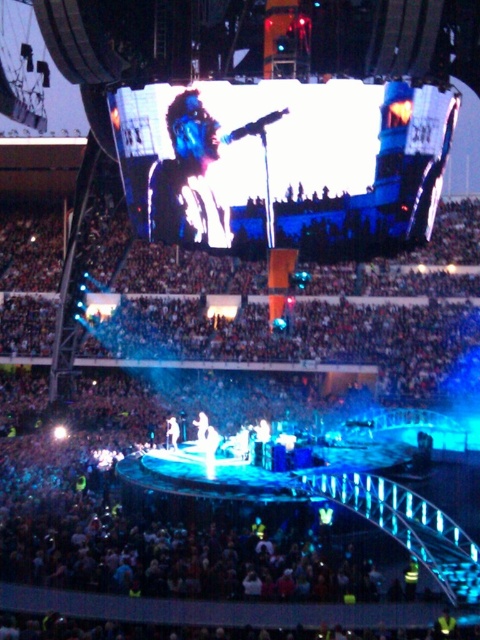
Question: Does matte black face at upper center have a smaller size compared to shiny silver microphone at center?

Choices:
 (A) no
 (B) yes

Answer: (A)

Question: Is matte black face at upper center smaller than shiny silver microphone at center?

Choices:
 (A) no
 (B) yes

Answer: (A)

Question: Is matte black face at upper center to the left of shiny silver microphone at center from the viewer's perspective?

Choices:
 (A) yes
 (B) no

Answer: (B)

Question: Among these points, which one is farthest from the camera?

Choices:
 (A) (166, 435)
 (B) (154, 179)

Answer: (A)

Question: Which point is farther to the camera?

Choices:
 (A) matte black face at upper center
 (B) shiny silver microphone at center

Answer: (B)